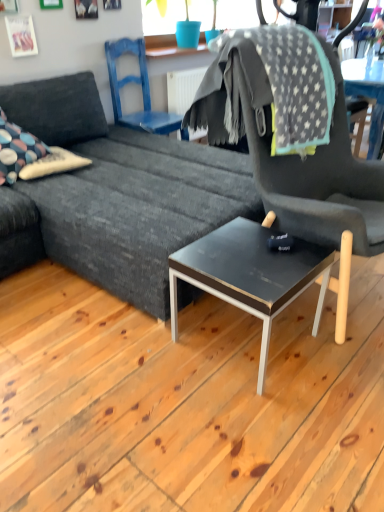
Question: Should I look upward or downward to see gray star-patterned blanket at upper right?

Choices:
 (A) up
 (B) down

Answer: (A)

Question: Considering the relative sizes of dark gray fabric couch at center and multicolored fabric pillow at left in the image provided, is dark gray fabric couch at center thinner than multicolored fabric pillow at left?

Choices:
 (A) no
 (B) yes

Answer: (A)

Question: From the image's perspective, does dark gray fabric couch at center appear lower than multicolored fabric pillow at left?

Choices:
 (A) yes
 (B) no

Answer: (B)

Question: From a real-world perspective, is dark gray fabric couch at center physically below multicolored fabric pillow at left?

Choices:
 (A) yes
 (B) no

Answer: (A)

Question: Is dark gray fabric couch at center in contact with multicolored fabric pillow at left?

Choices:
 (A) no
 (B) yes

Answer: (A)

Question: Can you confirm if dark gray fabric couch at center is taller than multicolored fabric pillow at left?

Choices:
 (A) yes
 (B) no

Answer: (A)

Question: Is dark gray fabric couch at center facing away from multicolored fabric pillow at left?

Choices:
 (A) no
 (B) yes

Answer: (B)

Question: Considering the relative sizes of blue painted wood chair at upper center, the 2th chair viewed from the right, and gray star-patterned blanket at upper right in the image provided, is blue painted wood chair at upper center, the 2th chair viewed from the right, thinner than gray star-patterned blanket at upper right?

Choices:
 (A) no
 (B) yes

Answer: (B)

Question: Is blue painted wood chair at upper center, which is counted as the first chair, starting from the back, outside gray star-patterned blanket at upper right?

Choices:
 (A) no
 (B) yes

Answer: (B)

Question: Is blue painted wood chair at upper center, which ranks as the second chair in front-to-back order, next to gray star-patterned blanket at upper right?

Choices:
 (A) yes
 (B) no

Answer: (B)

Question: Could you tell me if blue painted wood chair at upper center, which ranks as the second chair in front-to-back order, is turned towards gray star-patterned blanket at upper right?

Choices:
 (A) no
 (B) yes

Answer: (A)

Question: Does blue painted wood chair at upper center, the 2th chair viewed from the right, have a smaller size compared to gray star-patterned blanket at upper right?

Choices:
 (A) yes
 (B) no

Answer: (A)

Question: From the image's perspective, would you say blue painted wood chair at upper center, which is counted as the first chair, starting from the back, is shown under gray star-patterned blanket at upper right?

Choices:
 (A) yes
 (B) no

Answer: (B)

Question: Is multicolored fabric pillow at left a part of blue painted wood chair at upper center, acting as the 1th chair starting from the left?

Choices:
 (A) yes
 (B) no

Answer: (B)